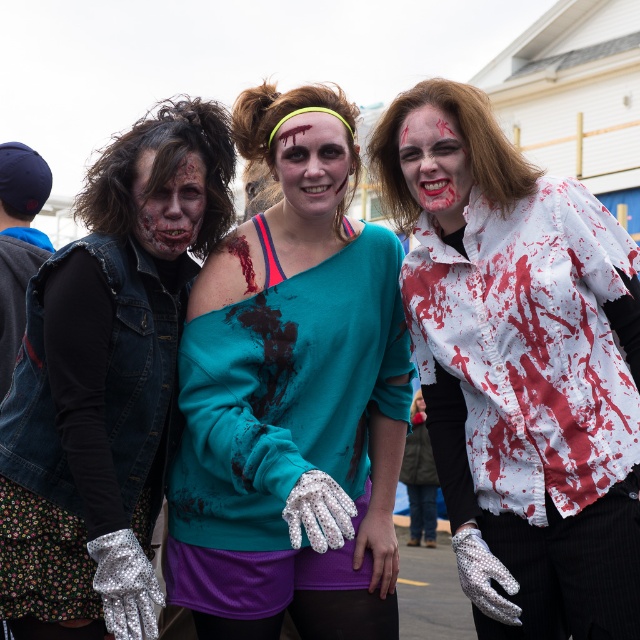
Question: Is white textured shirt at center thinner than matte flesh-colored makeup at center?

Choices:
 (A) yes
 (B) no

Answer: (B)

Question: Where is silver metallic glove at left located in relation to matte white face at center in the image?

Choices:
 (A) below
 (B) above

Answer: (A)

Question: Which object is positioned closest to the matte flesh-colored makeup at center?

Choices:
 (A) matte white face at center
 (B) blood splattered face at center
 (C) teal fabric shirt at center
 (D) silver metallic glove at left

Answer: (D)

Question: Among these points, which one is nearest to the camera?

Choices:
 (A) (371, 572)
 (B) (195, 176)

Answer: (B)

Question: Does teal fabric shirt at center have a larger size compared to matte white face at center?

Choices:
 (A) yes
 (B) no

Answer: (A)

Question: Which point is farther to the camera?

Choices:
 (A) (333, 604)
 (B) (310, 179)
 (C) (458, 224)

Answer: (B)